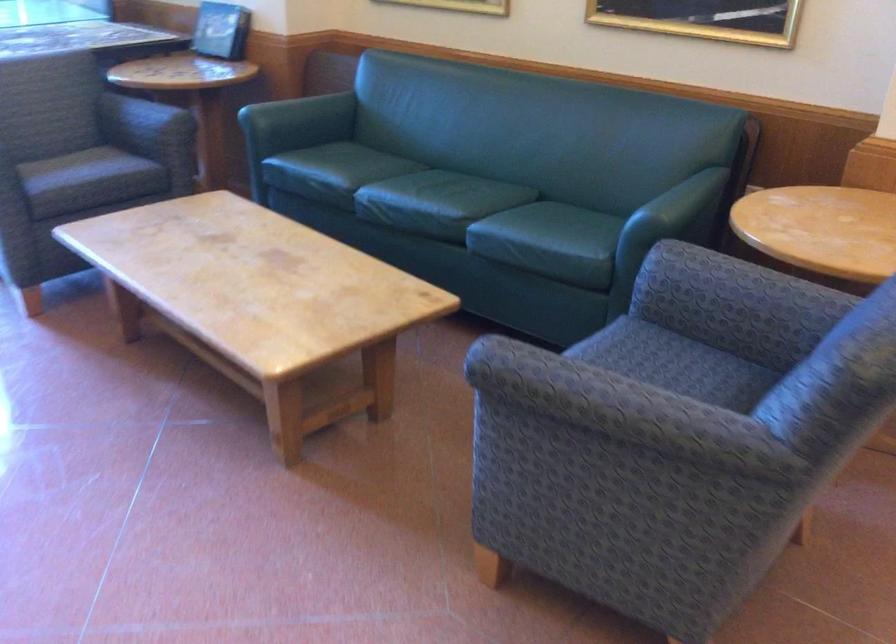
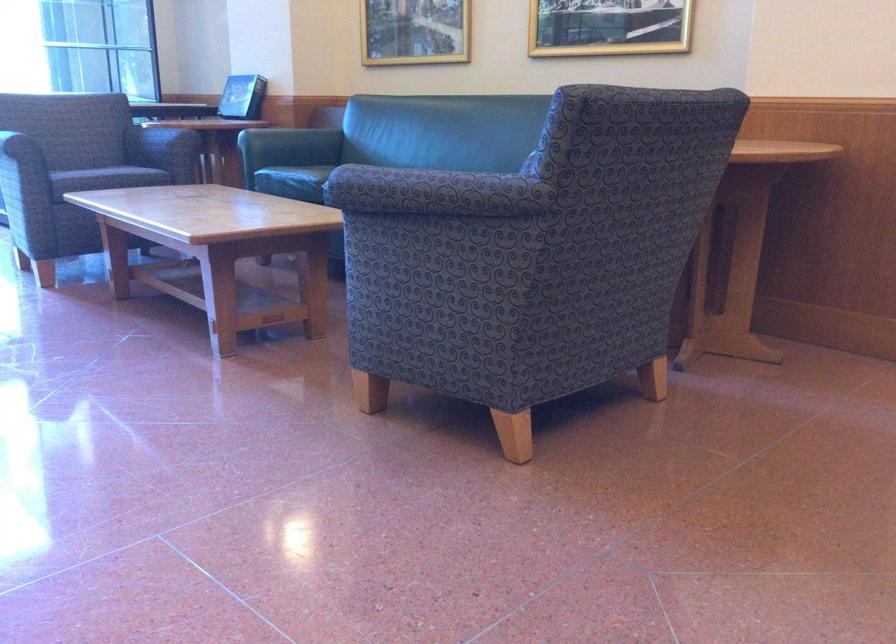
Find the pixel in the second image that matches (605,419) in the first image.

(425, 192)